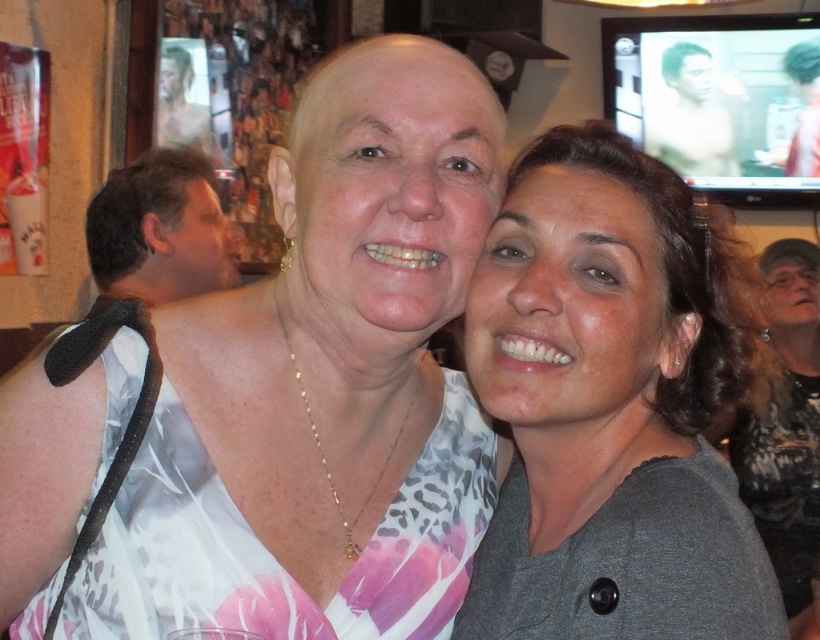
Is point (691, 106) in front of point (181, 125)?

No, (691, 106) is further to viewer.

Consider the image. Can you confirm if shiny skin man at upper right is positioned above shiny silver hair at upper center?

Yes, shiny skin man at upper right is above shiny silver hair at upper center.

The image size is (820, 640). Describe the element at coordinates (691, 116) in the screenshot. I see `shiny skin man at upper right` at that location.

The image size is (820, 640). Find the location of `shiny skin man at upper right`. shiny skin man at upper right is located at coordinates (691, 116).

Who is more forward, (736, 470) or (164, 86)?

Point (736, 470)

Based on the photo, between dark brown hair at right and shiny silver hair at upper center, which one has less height?

shiny silver hair at upper center is shorter.

Is point (789, 516) more distant than point (199, 134)?

No, it is in front of (199, 134).

The height and width of the screenshot is (640, 820). Find the location of `dark brown hair at right`. dark brown hair at right is located at coordinates (786, 433).

Does gray matte shirt at center have a lesser width compared to brown hair at left?

Correct, gray matte shirt at center's width is less than brown hair at left's.

Locate an element on the screen. The width and height of the screenshot is (820, 640). gray matte shirt at center is located at coordinates (613, 404).

Which is in front, point (700, 484) or point (131, 196)?

Positioned in front is point (700, 484).

In order to click on gray matte shirt at center in this screenshot , I will do `click(613, 404)`.